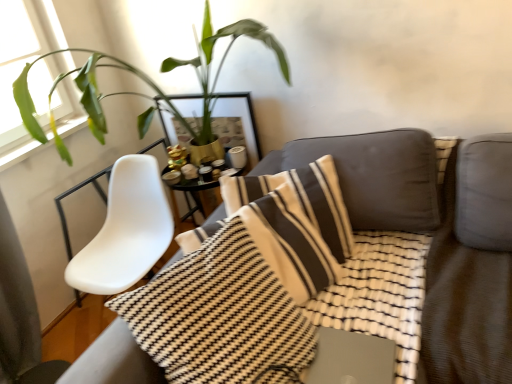
Identify the location of free spot above gold metallic picture frame at upper center (from a real-world perspective). (188, 97).